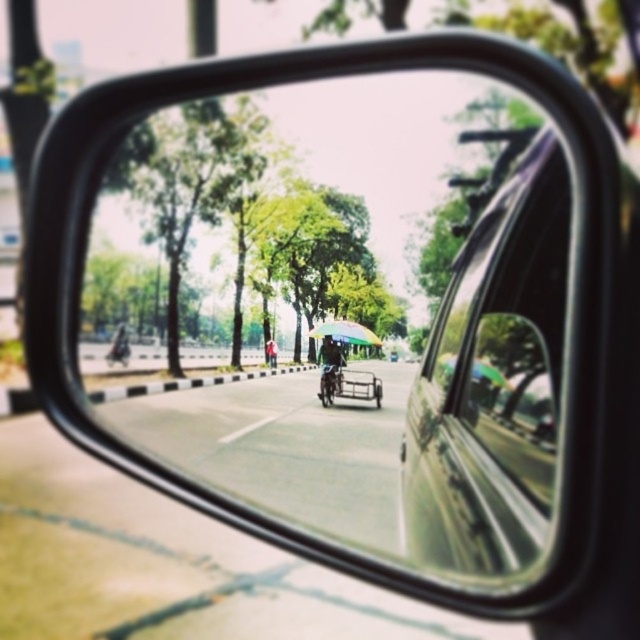
Question: Does metallic silver bicycle at center come in front of green fabric umbrella at center?

Choices:
 (A) no
 (B) yes

Answer: (B)

Question: Which point is farther to the camera?

Choices:
 (A) (337, 378)
 (B) (113, 337)

Answer: (B)

Question: Which object appears farthest from the camera in this image?

Choices:
 (A) green fabric umbrella at center
 (B) metallic silver car window at center-right
 (C) clear glass mirror at center

Answer: (A)

Question: From the image, what is the correct spatial relationship of metallic silver car window at center-right in relation to metallic silver bicycle at center?

Choices:
 (A) above
 (B) below

Answer: (A)

Question: Can you confirm if clear glass mirror at center is positioned to the left of green fabric umbrella at center?

Choices:
 (A) yes
 (B) no

Answer: (B)

Question: Among these points, which one is farthest from the camera?

Choices:
 (A) (547, 333)
 (B) (410, 445)

Answer: (B)